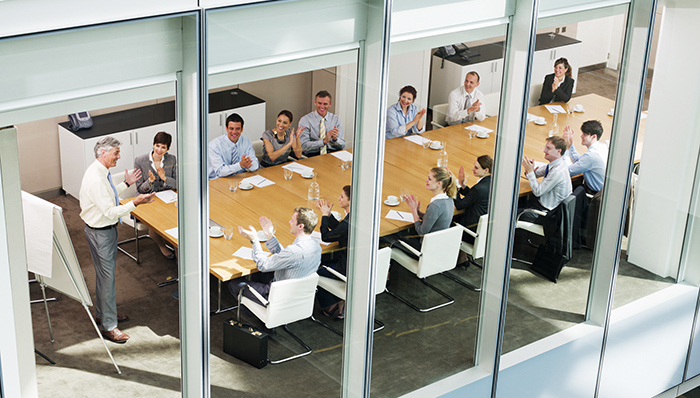
Locate an element on the screen. This screenshot has width=700, height=398. cabinet handles is located at coordinates (130, 142), (139, 141), (220, 117), (228, 113), (490, 73), (496, 67), (547, 59), (554, 57).